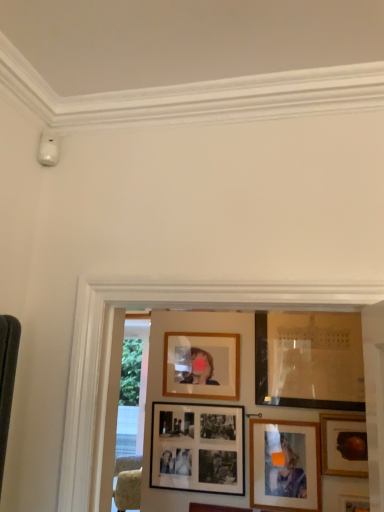
Identify the location of wooden photo frame at lower right, marked as the first picture frame in a bottom-to-top arrangement. (353, 503).

In order to face matte wooden picture frame at lower right, the 5th picture frame from the top, should I rotate leftwards or rightwards?

To face it directly, rotate right by 12.387 degrees.

This screenshot has height=512, width=384. Describe the element at coordinates (198, 448) in the screenshot. I see `black matte picture frame at center, placed as the third picture frame when sorted from bottom to top` at that location.

You are a GUI agent. You are given a task and a screenshot of the screen. Output one action in this format:
    pyautogui.click(x=<x>, y=<y>)
    Task: Click on the black matte picture frame at center, acting as the 4th picture frame starting from the top
    The width and height of the screenshot is (384, 512).
    Given the screenshot: What is the action you would take?
    (x=198, y=448)

In order to face wooden frame at upper center, which is counted as the 2th picture frame, starting from the top, should I rotate leftwards or rightwards?

Turn right by 1.291 degrees to look at wooden frame at upper center, which is counted as the 2th picture frame, starting from the top.

What is the approximate height of matte glass picture frame at upper right, which is counted as the sixth picture frame, starting from the bottom?

It is 64.75 centimeters.

Where is `wooden photo frame at lower right, marked as the first picture frame in a bottom-to-top arrangement`? wooden photo frame at lower right, marked as the first picture frame in a bottom-to-top arrangement is located at coordinates (353, 503).

Can we say matte wooden picture frame at lower right, which appears as the 2th picture frame when ordered from the bottom, lies outside wooden frame at upper center, which is counted as the 2th picture frame, starting from the top?

Indeed, matte wooden picture frame at lower right, which appears as the 2th picture frame when ordered from the bottom, is completely outside wooden frame at upper center, which is counted as the 2th picture frame, starting from the top.

From a real-world perspective, does matte wooden picture frame at lower right, which appears as the 2th picture frame when ordered from the bottom, stand above wooden frame at upper center, which is counted as the 2th picture frame, starting from the top?

No, from a real-world perspective, matte wooden picture frame at lower right, which appears as the 2th picture frame when ordered from the bottom, is not on top of wooden frame at upper center, which is counted as the 2th picture frame, starting from the top.

Considering the sizes of matte wooden picture frame at lower right, the 5th picture frame from the top, and wooden frame at upper center, the 5th picture frame ordered from the bottom, in the image, is matte wooden picture frame at lower right, the 5th picture frame from the top, wider or thinner than wooden frame at upper center, the 5th picture frame ordered from the bottom,?

matte wooden picture frame at lower right, the 5th picture frame from the top, is wider than wooden frame at upper center, the 5th picture frame ordered from the bottom.

Is matte wooden picture frame at lower right, the 5th picture frame from the top, smaller than wooden photo frame at lower right, which is the 6th picture frame in top-to-bottom order?

No.

Could you tell me if matte wooden picture frame at lower right, which appears as the 2th picture frame when ordered from the bottom, is facing wooden photo frame at lower right, marked as the first picture frame in a bottom-to-top arrangement?

No, matte wooden picture frame at lower right, which appears as the 2th picture frame when ordered from the bottom, is not turned towards wooden photo frame at lower right, marked as the first picture frame in a bottom-to-top arrangement.

From the picture: How much distance is there between matte wooden picture frame at lower right, the 5th picture frame from the top, and wooden photo frame at lower right, marked as the first picture frame in a bottom-to-top arrangement?

14.76 inches.

From a real-world perspective, is matte wooden picture frame at lower right, the 5th picture frame from the top, on top of wooden photo frame at lower right, which is the 6th picture frame in top-to-bottom order?

Yes, from a real-world perspective, matte wooden picture frame at lower right, the 5th picture frame from the top, is above wooden photo frame at lower right, which is the 6th picture frame in top-to-bottom order.

In the image, is wooden photo frame at lower right, marked as the first picture frame in a bottom-to-top arrangement, on the left side or the right side of matte glass picture frame at upper right, which ranks as the 1th picture frame in top-to-bottom order?

From the image, it's evident that wooden photo frame at lower right, marked as the first picture frame in a bottom-to-top arrangement, is to the right of matte glass picture frame at upper right, which ranks as the 1th picture frame in top-to-bottom order.

Does wooden photo frame at lower right, marked as the first picture frame in a bottom-to-top arrangement, turn towards matte glass picture frame at upper right, which is counted as the sixth picture frame, starting from the bottom?

No, wooden photo frame at lower right, marked as the first picture frame in a bottom-to-top arrangement, does not turn towards matte glass picture frame at upper right, which is counted as the sixth picture frame, starting from the bottom.

From the image's perspective, who appears lower, wooden photo frame at lower right, marked as the first picture frame in a bottom-to-top arrangement, or matte glass picture frame at upper right, which ranks as the 1th picture frame in top-to-bottom order?

From the image's view, wooden photo frame at lower right, marked as the first picture frame in a bottom-to-top arrangement, is below.

Is wooden photo frame at lower right, which is the 6th picture frame in top-to-bottom order, positioned before matte glass picture frame at upper right, which is counted as the sixth picture frame, starting from the bottom?

Yes, the depth of wooden photo frame at lower right, which is the 6th picture frame in top-to-bottom order, is less than that of matte glass picture frame at upper right, which is counted as the sixth picture frame, starting from the bottom.

Are gold-framed painting at lower right, the 4th picture frame from the bottom, and wooden frame at upper center, which is counted as the 2th picture frame, starting from the top, making contact?

No, gold-framed painting at lower right, the 4th picture frame from the bottom, is not beside wooden frame at upper center, which is counted as the 2th picture frame, starting from the top.

Considering the relative sizes of gold-framed painting at lower right, which appears as the third picture frame when viewed from the top, and wooden frame at upper center, which is counted as the 2th picture frame, starting from the top, in the image provided, is gold-framed painting at lower right, which appears as the third picture frame when viewed from the top, bigger than wooden frame at upper center, which is counted as the 2th picture frame, starting from the top,?

Incorrect, gold-framed painting at lower right, which appears as the third picture frame when viewed from the top, is not larger than wooden frame at upper center, which is counted as the 2th picture frame, starting from the top.

Is gold-framed painting at lower right, which appears as the third picture frame when viewed from the top, positioned behind wooden frame at upper center, which is counted as the 2th picture frame, starting from the top?

No, it is not.

From the image's perspective, would you say gold-framed painting at lower right, the 4th picture frame from the bottom, is shown under wooden frame at upper center, which is counted as the 2th picture frame, starting from the top?

Correct, gold-framed painting at lower right, the 4th picture frame from the bottom, appears lower than wooden frame at upper center, which is counted as the 2th picture frame, starting from the top, in the image.

What are the coordinates of `the 2nd picture frame below the black matte picture frame at center, placed as the third picture frame when sorted from bottom to top (from a real-world perspective)` in the screenshot? It's located at (353, 503).

From a real-world perspective, is black matte picture frame at center, acting as the 4th picture frame starting from the top, above or below wooden photo frame at lower right, marked as the first picture frame in a bottom-to-top arrangement?

Clearly, from a real-world perspective, black matte picture frame at center, acting as the 4th picture frame starting from the top, is above wooden photo frame at lower right, marked as the first picture frame in a bottom-to-top arrangement.

Is black matte picture frame at center, acting as the 4th picture frame starting from the top, inside the boundaries of wooden photo frame at lower right, which is the 6th picture frame in top-to-bottom order, or outside?

black matte picture frame at center, acting as the 4th picture frame starting from the top, is not inside wooden photo frame at lower right, which is the 6th picture frame in top-to-bottom order, it's outside.

From the picture: Does black matte picture frame at center, acting as the 4th picture frame starting from the top, have a lesser width compared to wooden photo frame at lower right, marked as the first picture frame in a bottom-to-top arrangement?

Yes, black matte picture frame at center, acting as the 4th picture frame starting from the top, is thinner than wooden photo frame at lower right, marked as the first picture frame in a bottom-to-top arrangement.

How many degrees apart are the facing directions of matte wooden picture frame at lower right, which appears as the 2th picture frame when ordered from the bottom, and gold-framed painting at lower right, which appears as the third picture frame when viewed from the top?

0.00367 degrees separate the facing orientations of matte wooden picture frame at lower right, which appears as the 2th picture frame when ordered from the bottom, and gold-framed painting at lower right, which appears as the third picture frame when viewed from the top.

Choose the correct answer: Is matte wooden picture frame at lower right, which appears as the 2th picture frame when ordered from the bottom, inside gold-framed painting at lower right, which appears as the third picture frame when viewed from the top, or outside it?

matte wooden picture frame at lower right, which appears as the 2th picture frame when ordered from the bottom, cannot be found inside gold-framed painting at lower right, which appears as the third picture frame when viewed from the top.

What are the coordinates of `the 2nd picture frame above the matte wooden picture frame at lower right, which appears as the 2th picture frame when ordered from the bottom (from the image's perspective)` in the screenshot? It's located at (344, 445).

From their relative heights in the image, would you say matte wooden picture frame at lower right, which appears as the 2th picture frame when ordered from the bottom, is taller or shorter than gold-framed painting at lower right, which appears as the third picture frame when viewed from the top?

In the image, matte wooden picture frame at lower right, which appears as the 2th picture frame when ordered from the bottom, appears to be taller than gold-framed painting at lower right, which appears as the third picture frame when viewed from the top.

From their relative heights in the image, would you say gold-framed painting at lower right, the 4th picture frame from the bottom, is taller or shorter than matte wooden picture frame at lower right, the 5th picture frame from the top?

In the image, gold-framed painting at lower right, the 4th picture frame from the bottom, appears to be shorter than matte wooden picture frame at lower right, the 5th picture frame from the top.

Who is smaller, gold-framed painting at lower right, which appears as the third picture frame when viewed from the top, or matte wooden picture frame at lower right, which appears as the 2th picture frame when ordered from the bottom?

gold-framed painting at lower right, which appears as the third picture frame when viewed from the top, is smaller.

Is gold-framed painting at lower right, which appears as the third picture frame when viewed from the top, oriented away from matte wooden picture frame at lower right, which appears as the 2th picture frame when ordered from the bottom?

gold-framed painting at lower right, which appears as the third picture frame when viewed from the top, does not have its back to matte wooden picture frame at lower right, which appears as the 2th picture frame when ordered from the bottom.

Can you confirm if gold-framed painting at lower right, the 4th picture frame from the bottom, is wider than matte wooden picture frame at lower right, which appears as the 2th picture frame when ordered from the bottom?

Indeed, gold-framed painting at lower right, the 4th picture frame from the bottom, has a greater width compared to matte wooden picture frame at lower right, which appears as the 2th picture frame when ordered from the bottom.

From the image's perspective, starting from the matte wooden picture frame at lower right, which appears as the 2th picture frame when ordered from the bottom, which picture frame is the 3rd one above? Please provide its 2D coordinates.

[(201, 365)]

Locate an element on the screen. picture frame directly beneath the matte wooden picture frame at lower right, the 5th picture frame from the top (from a real-world perspective) is located at coordinates (353, 503).

When comparing their distances from matte glass picture frame at upper right, which ranks as the 1th picture frame in top-to-bottom order, does black matte picture frame at center, placed as the third picture frame when sorted from bottom to top, or gold-framed painting at lower right, which appears as the third picture frame when viewed from the top, seem further?

Among the two, black matte picture frame at center, placed as the third picture frame when sorted from bottom to top, is located further to matte glass picture frame at upper right, which ranks as the 1th picture frame in top-to-bottom order.

Estimate the real-world distances between objects in this image. Which object is closer to black matte picture frame at center, acting as the 4th picture frame starting from the top, matte glass picture frame at upper right, which ranks as the 1th picture frame in top-to-bottom order, or gold-framed painting at lower right, the 4th picture frame from the bottom?

The object closer to black matte picture frame at center, acting as the 4th picture frame starting from the top, is matte glass picture frame at upper right, which ranks as the 1th picture frame in top-to-bottom order.

From the image, which object appears to be farther from wooden frame at upper center, the 5th picture frame ordered from the bottom, black matte picture frame at center, acting as the 4th picture frame starting from the top, or gold-framed painting at lower right, which appears as the third picture frame when viewed from the top?

gold-framed painting at lower right, which appears as the third picture frame when viewed from the top, is positioned further to the anchor wooden frame at upper center, the 5th picture frame ordered from the bottom.

Considering their positions, is wooden photo frame at lower right, which is the 6th picture frame in top-to-bottom order, positioned closer to matte glass picture frame at upper right, which ranks as the 1th picture frame in top-to-bottom order, than gold-framed painting at lower right, which appears as the third picture frame when viewed from the top?

gold-framed painting at lower right, which appears as the third picture frame when viewed from the top, lies closer to matte glass picture frame at upper right, which ranks as the 1th picture frame in top-to-bottom order, than the other object.

Looking at the image, which one is located closer to gold-framed painting at lower right, which appears as the third picture frame when viewed from the top, matte wooden picture frame at lower right, the 5th picture frame from the top, or matte glass picture frame at upper right, which is counted as the sixth picture frame, starting from the bottom?

matte wooden picture frame at lower right, the 5th picture frame from the top, lies closer to gold-framed painting at lower right, which appears as the third picture frame when viewed from the top, than the other object.

Considering their positions, is matte wooden picture frame at lower right, the 5th picture frame from the top, positioned further to wooden frame at upper center, the 5th picture frame ordered from the bottom, than matte glass picture frame at upper right, which ranks as the 1th picture frame in top-to-bottom order?

matte wooden picture frame at lower right, the 5th picture frame from the top, is further to wooden frame at upper center, the 5th picture frame ordered from the bottom.

From the image, which object appears to be nearer to matte wooden picture frame at lower right, the 5th picture frame from the top, matte glass picture frame at upper right, which ranks as the 1th picture frame in top-to-bottom order, or wooden photo frame at lower right, which is the 6th picture frame in top-to-bottom order?

wooden photo frame at lower right, which is the 6th picture frame in top-to-bottom order, is closer to matte wooden picture frame at lower right, the 5th picture frame from the top.

Which object lies nearer to the anchor point black matte picture frame at center, acting as the 4th picture frame starting from the top, matte wooden picture frame at lower right, the 5th picture frame from the top, or wooden photo frame at lower right, marked as the first picture frame in a bottom-to-top arrangement?

matte wooden picture frame at lower right, the 5th picture frame from the top.

Where is `picture frame between wooden frame at upper center, the 5th picture frame ordered from the bottom, and matte glass picture frame at upper right, which is counted as the sixth picture frame, starting from the bottom, in the horizontal direction`? Image resolution: width=384 pixels, height=512 pixels. picture frame between wooden frame at upper center, the 5th picture frame ordered from the bottom, and matte glass picture frame at upper right, which is counted as the sixth picture frame, starting from the bottom, in the horizontal direction is located at coordinates (285, 466).

Where is `picture frame between black matte picture frame at center, acting as the 4th picture frame starting from the top, and matte wooden picture frame at lower right, which appears as the 2th picture frame when ordered from the bottom`? The width and height of the screenshot is (384, 512). picture frame between black matte picture frame at center, acting as the 4th picture frame starting from the top, and matte wooden picture frame at lower right, which appears as the 2th picture frame when ordered from the bottom is located at coordinates (201, 365).